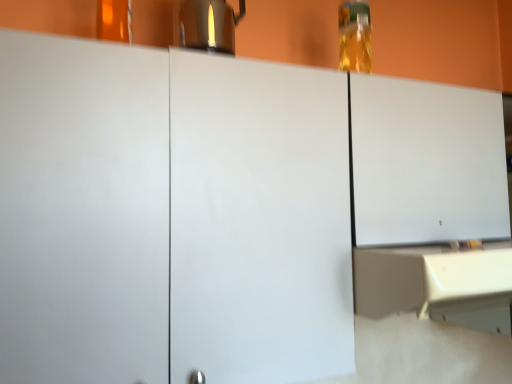
Question: Can you confirm if satin silver coffee pot at upper center is smaller than beige matte counter at lower right?

Choices:
 (A) yes
 (B) no

Answer: (A)

Question: From the image's perspective, is satin silver coffee pot at upper center over beige matte counter at lower right?

Choices:
 (A) no
 (B) yes

Answer: (B)

Question: From the image's perspective, is satin silver coffee pot at upper center below beige matte counter at lower right?

Choices:
 (A) yes
 (B) no

Answer: (B)

Question: Is satin silver coffee pot at upper center in contact with beige matte counter at lower right?

Choices:
 (A) no
 (B) yes

Answer: (A)

Question: Does satin silver coffee pot at upper center appear on the right side of beige matte counter at lower right?

Choices:
 (A) no
 (B) yes

Answer: (A)

Question: From the image's perspective, is satin silver coffee pot at upper center positioned above or below beige matte counter at lower right?

Choices:
 (A) below
 (B) above

Answer: (B)

Question: In the image, is satin silver coffee pot at upper center positioned in front of or behind beige matte counter at lower right?

Choices:
 (A) behind
 (B) front

Answer: (A)

Question: Is satin silver coffee pot at upper center bigger or smaller than beige matte counter at lower right?

Choices:
 (A) big
 (B) small

Answer: (B)

Question: Which is correct: satin silver coffee pot at upper center is inside beige matte counter at lower right, or outside of it?

Choices:
 (A) outside
 (B) inside

Answer: (A)

Question: Relative to satin silver coffee pot at upper center, is beige matte counter at lower right in front or behind?

Choices:
 (A) behind
 (B) front

Answer: (B)

Question: Is point pos(371,314) positioned closer to the camera than point pos(200,36)?

Choices:
 (A) closer
 (B) farther

Answer: (A)

Question: From their relative heights in the image, would you say beige matte counter at lower right is taller or shorter than satin silver coffee pot at upper center?

Choices:
 (A) tall
 (B) short

Answer: (B)

Question: From the image's perspective, is beige matte counter at lower right located above or below satin silver coffee pot at upper center?

Choices:
 (A) below
 (B) above

Answer: (A)

Question: From the image's perspective, is satin silver coffee pot at upper center located above or below translucent glass bottle at upper right?

Choices:
 (A) below
 (B) above

Answer: (A)

Question: Considering the positions of satin silver coffee pot at upper center and translucent glass bottle at upper right in the image, is satin silver coffee pot at upper center wider or thinner than translucent glass bottle at upper right?

Choices:
 (A) thin
 (B) wide

Answer: (B)